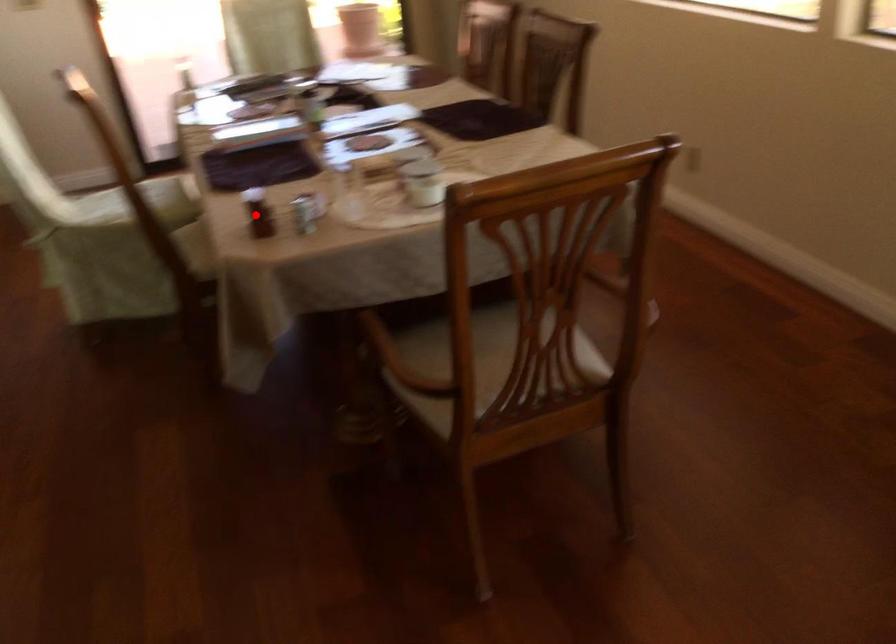
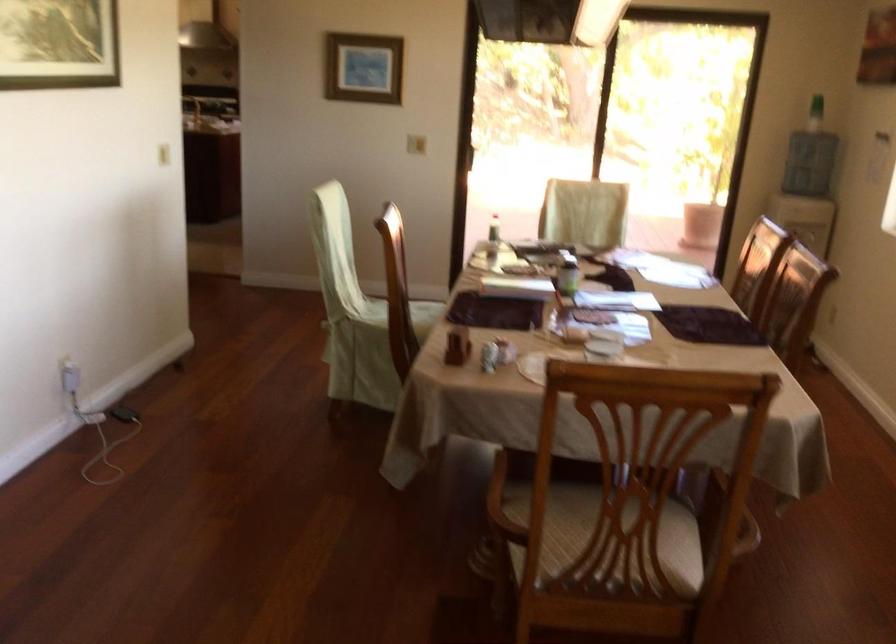
Question: I am providing you with two images of the same scene from different viewpoints. A red point is shown in image1. For the corresponding object point in image2, is it positioned nearer or farther from the camera?

Choices:
 (A) Nearer
 (B) Farther

Answer: (B)